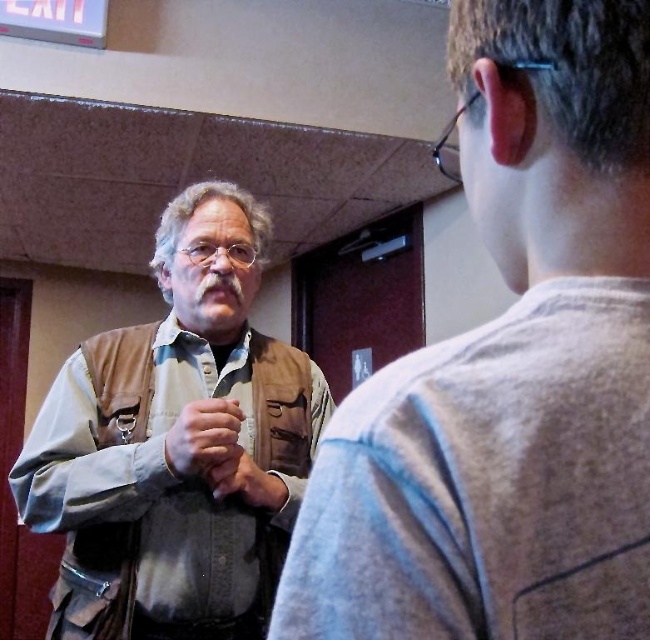
Question: Observing the image, what is the correct spatial positioning of leather jacket at left in reference to matte brown leather hand at center?

Choices:
 (A) above
 (B) below

Answer: (A)

Question: Is matte brown vest at center to the left of matte brown leather hand at center from the viewer's perspective?

Choices:
 (A) no
 (B) yes

Answer: (B)

Question: Which of the following is the closest to the observer?

Choices:
 (A) leather jacket at left
 (B) matte brown leather hand at center

Answer: (A)

Question: Among these objects, which one is nearest to the camera?

Choices:
 (A) matte brown vest at center
 (B) matte brown leather hand at center

Answer: (A)

Question: Can you confirm if matte brown vest at center is wider than matte brown leather hand at center?

Choices:
 (A) yes
 (B) no

Answer: (A)

Question: Based on their relative distances, which object is nearer to the leather jacket at left?

Choices:
 (A) brown/camouflage vest at left
 (B) matte brown leather hand at center

Answer: (B)